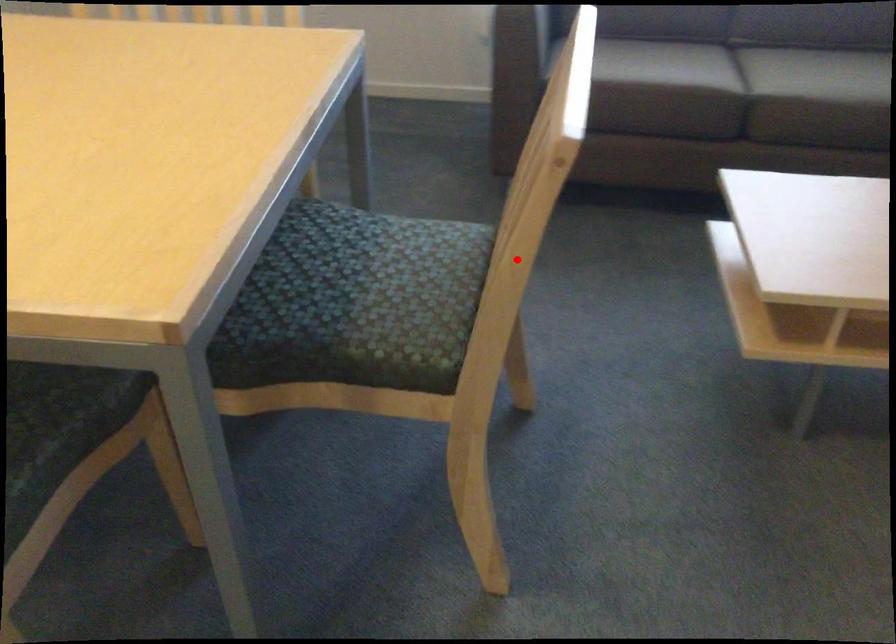
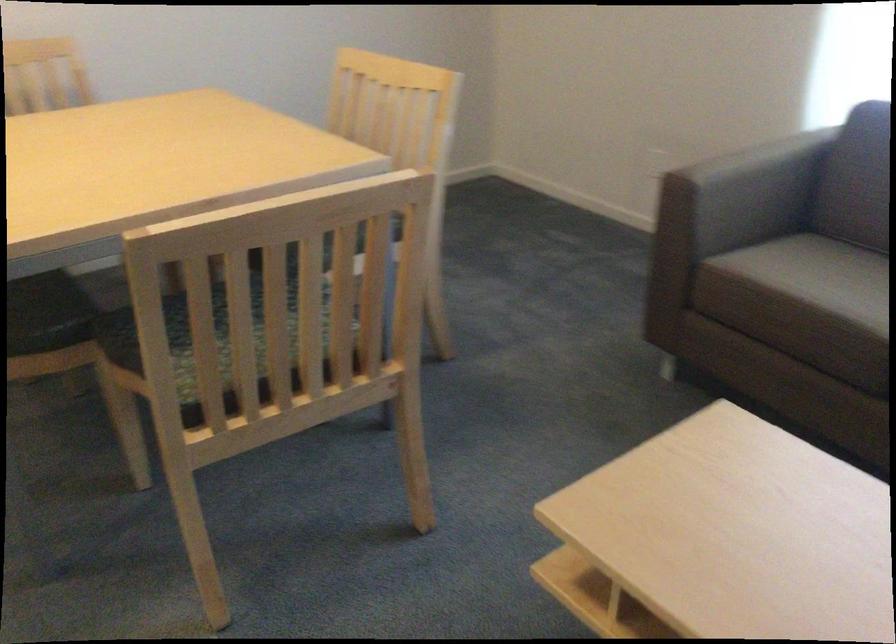
Question: I am providing you with two images of the same scene from different viewpoints. A red point is shown in image1. For the corresponding object point in image2, is it positioned nearer or farther from the camera?

Choices:
 (A) Nearer
 (B) Farther

Answer: (B)